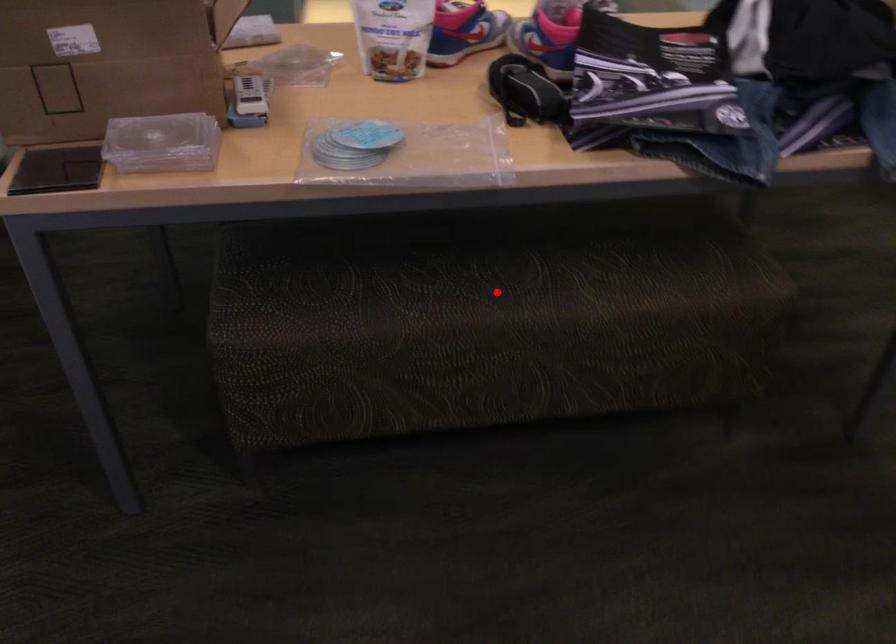
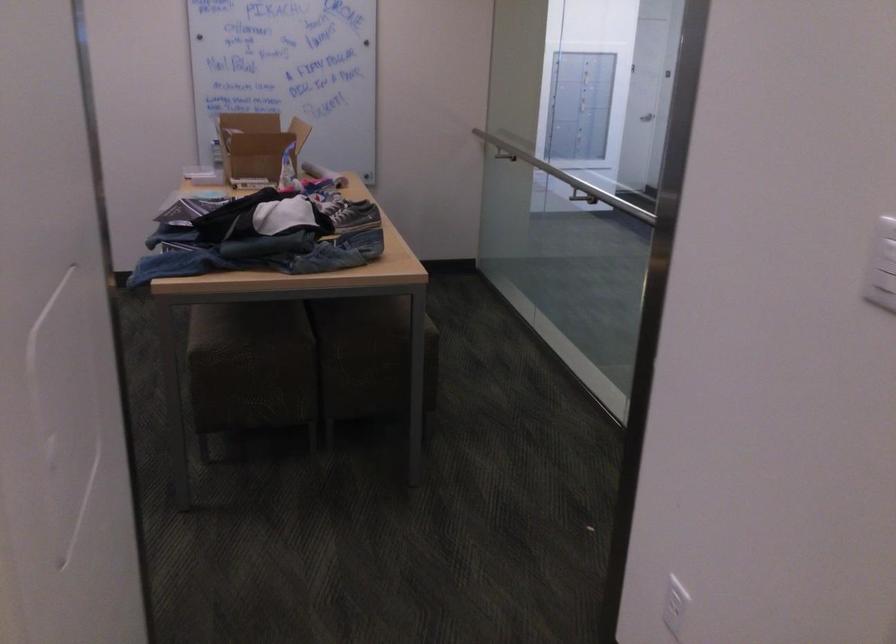
Question: I am providing you with two images of the same scene from different viewpoints. A red point is marked on the first image. Can you still see the location of the red point in image 2?

Choices:
 (A) Yes
 (B) No

Answer: (B)